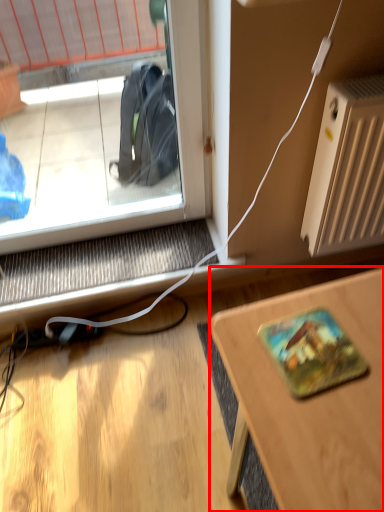
Question: Considering the relative positions of desk (annotated by the red box) and radiator in the image provided, where is desk (annotated by the red box) located with respect to the staircase?

Choices:
 (A) left
 (B) right

Answer: (A)